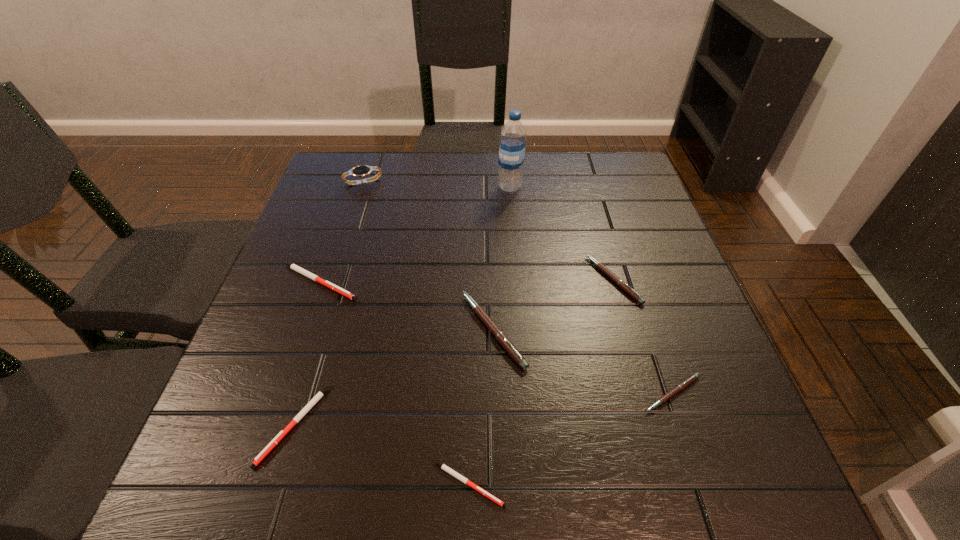
This screenshot has width=960, height=540. Identify the location of the tallest object. (513, 134).

Where is `blue water bottle`? blue water bottle is located at coordinates (513, 134).

Identify the location of the second tallest object. (359, 171).

You are a GUI agent. You are given a task and a screenshot of the screen. Output one action in this format:
    pyautogui.click(x=<x>, y=<y>)
    Task: Click on the watch
    The height and width of the screenshot is (540, 960).
    Given the screenshot: What is the action you would take?
    pyautogui.click(x=359, y=171)

Where is `the tallest pen`? Image resolution: width=960 pixels, height=540 pixels. the tallest pen is located at coordinates (500, 336).

The height and width of the screenshot is (540, 960). What are the coordinates of `the leftmost pink pen` in the screenshot? It's located at (500, 336).

You are a GUI agent. You are given a task and a screenshot of the screen. Output one action in this format:
    pyautogui.click(x=<x>, y=<y>)
    Task: Click on the second biggest pink pen
    This screenshot has height=540, width=960.
    Given the screenshot: What is the action you would take?
    pyautogui.click(x=624, y=286)

Locate an element on the screen. The image size is (960, 540). the biggest white pen is located at coordinates (294, 267).

Where is `the smallest pink pen`? The width and height of the screenshot is (960, 540). the smallest pink pen is located at coordinates (695, 376).

At what (x,y) coordinates should I click in order to perform the action: click on the second smallest white pen. Please return your answer as a coordinate pair (x, y). This screenshot has height=540, width=960. Looking at the image, I should click on (318, 396).